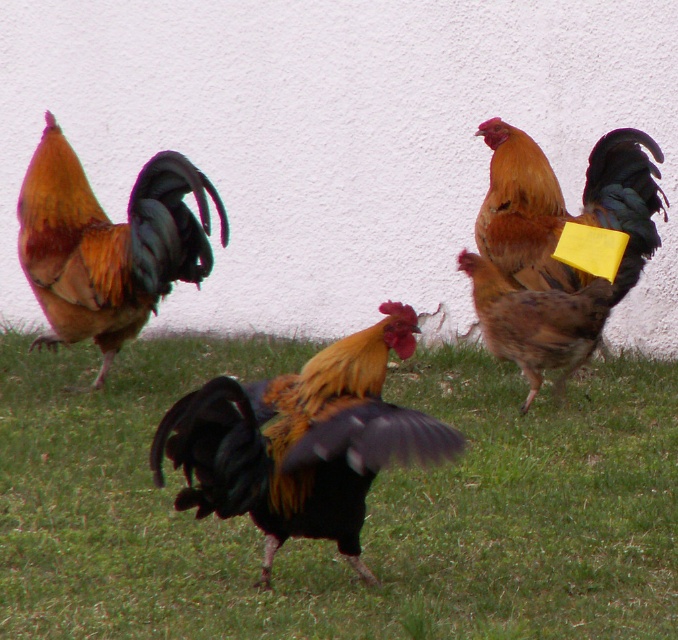
You are a gardener looking at the image of the chickens on the grassy area. You need to determine which area is wider between the green grass at center and the golden brown feathers at center. Which one is wider?

The green grass at center is wider than the golden brown feathers at center according to the description.

Based on the coordinates provided, which object is located at point (302, 442)?

The shiny black rooster at center is located at point (302, 442).